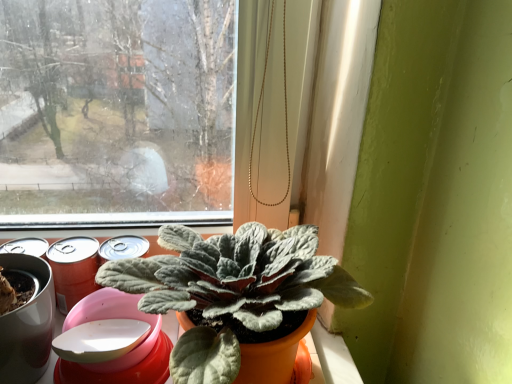
Question: Should I look upward or downward to see metallic red can at left?

Choices:
 (A) up
 (B) down

Answer: (B)

Question: From the image's perspective, is metallic red can at left located above fuzzy green plant at center?

Choices:
 (A) no
 (B) yes

Answer: (B)

Question: Does metallic red can at left have a lesser width compared to fuzzy green plant at center?

Choices:
 (A) no
 (B) yes

Answer: (B)

Question: From a real-world perspective, is metallic red can at left located beneath fuzzy green plant at center?

Choices:
 (A) yes
 (B) no

Answer: (A)

Question: Can you confirm if metallic red can at left is bigger than fuzzy green plant at center?

Choices:
 (A) no
 (B) yes

Answer: (A)

Question: Is metallic red can at left taller than fuzzy green plant at center?

Choices:
 (A) yes
 (B) no

Answer: (B)

Question: From the image's perspective, does metallic red can at left appear lower than fuzzy green plant at center?

Choices:
 (A) yes
 (B) no

Answer: (B)

Question: Considering the relative sizes of fuzzy green plant at center and metallic red can at left in the image provided, is fuzzy green plant at center smaller than metallic red can at left?

Choices:
 (A) no
 (B) yes

Answer: (A)

Question: Considering the relative positions of fuzzy green plant at center and metallic red can at left in the image provided, is fuzzy green plant at center to the right of metallic red can at left from the viewer's perspective?

Choices:
 (A) no
 (B) yes

Answer: (B)

Question: Is fuzzy green plant at center closer to the viewer compared to metallic red can at left?

Choices:
 (A) no
 (B) yes

Answer: (B)

Question: From the image's perspective, is fuzzy green plant at center under metallic red can at left?

Choices:
 (A) no
 (B) yes

Answer: (B)

Question: Is metallic red can at left located within fuzzy green plant at center?

Choices:
 (A) no
 (B) yes

Answer: (A)

Question: From a real-world perspective, is fuzzy green plant at center located higher than metallic red can at left?

Choices:
 (A) yes
 (B) no

Answer: (A)

Question: In terms of height, does fuzzy green plant at center look taller or shorter compared to metallic red can at left?

Choices:
 (A) tall
 (B) short

Answer: (A)